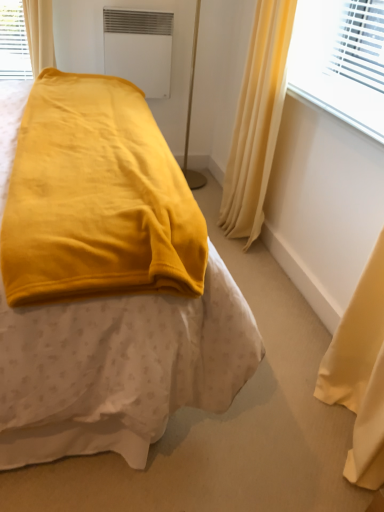
Question: Is silky yellow curtain at upper right at the left side of velvet yellow blanket at center?

Choices:
 (A) yes
 (B) no

Answer: (B)

Question: Considering the relative sizes of silky yellow curtain at upper right and velvet yellow blanket at center in the image provided, is silky yellow curtain at upper right taller than velvet yellow blanket at center?

Choices:
 (A) yes
 (B) no

Answer: (B)

Question: Is silky yellow curtain at upper right wider than velvet yellow blanket at center?

Choices:
 (A) yes
 (B) no

Answer: (B)

Question: Is silky yellow curtain at upper right not inside velvet yellow blanket at center?

Choices:
 (A) yes
 (B) no

Answer: (A)

Question: Could you tell me if silky yellow curtain at upper right is facing velvet yellow blanket at center?

Choices:
 (A) yes
 (B) no

Answer: (A)

Question: From the image's perspective, is silky yellow curtain at upper right above or below white matte air conditioning unit at upper center?

Choices:
 (A) above
 (B) below

Answer: (B)

Question: Is silky yellow curtain at upper right taller or shorter than white matte air conditioning unit at upper center?

Choices:
 (A) short
 (B) tall

Answer: (B)

Question: Considering the positions of silky yellow curtain at upper right and white matte air conditioning unit at upper center in the image, is silky yellow curtain at upper right wider or thinner than white matte air conditioning unit at upper center?

Choices:
 (A) thin
 (B) wide

Answer: (B)

Question: Is silky yellow curtain at upper right inside or outside of white matte air conditioning unit at upper center?

Choices:
 (A) inside
 (B) outside

Answer: (B)

Question: Considering the positions of velvet yellow blanket at center and white matte air conditioning unit at upper center in the image, is velvet yellow blanket at center bigger or smaller than white matte air conditioning unit at upper center?

Choices:
 (A) big
 (B) small

Answer: (A)

Question: From the image's perspective, is velvet yellow blanket at center located above or below white matte air conditioning unit at upper center?

Choices:
 (A) below
 (B) above

Answer: (A)

Question: Is velvet yellow blanket at center to the left or to the right of white matte air conditioning unit at upper center in the image?

Choices:
 (A) right
 (B) left

Answer: (B)

Question: Considering the positions of velvet yellow blanket at center and white matte air conditioning unit at upper center in the image, is velvet yellow blanket at center taller or shorter than white matte air conditioning unit at upper center?

Choices:
 (A) short
 (B) tall

Answer: (B)

Question: From their relative heights in the image, would you say smooth plastic window sill at upper right is taller or shorter than white matte air conditioning unit at upper center?

Choices:
 (A) tall
 (B) short

Answer: (B)

Question: Is smooth plastic window sill at upper right wider or thinner than white matte air conditioning unit at upper center?

Choices:
 (A) wide
 (B) thin

Answer: (A)